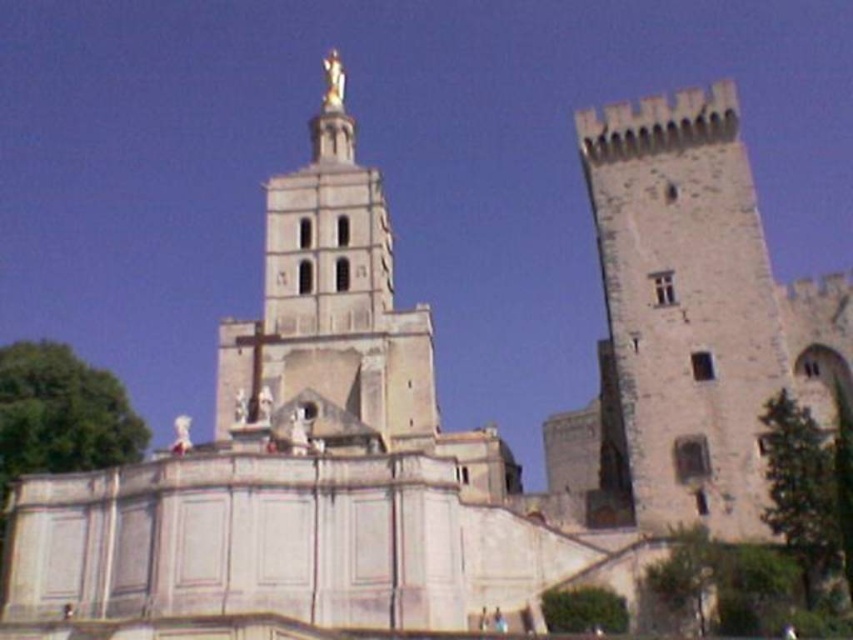
You are an architect examining the historic structure. You need to determine the spatial relationship between the stone medieval tower at right and the white marble statue at center. Which object is located to the right of the other?

The stone medieval tower at right is positioned on the right side of white marble statue at center, meaning the tower is to the right of the statue.

You are an architect assessing the structural integrity of the stone medieval tower at right and the white marble statue at center. Which object is more likely to require reinforcement due to its height?

The stone medieval tower at right is much taller than the white marble statue at center, so it is more likely to require reinforcement due to its greater height.